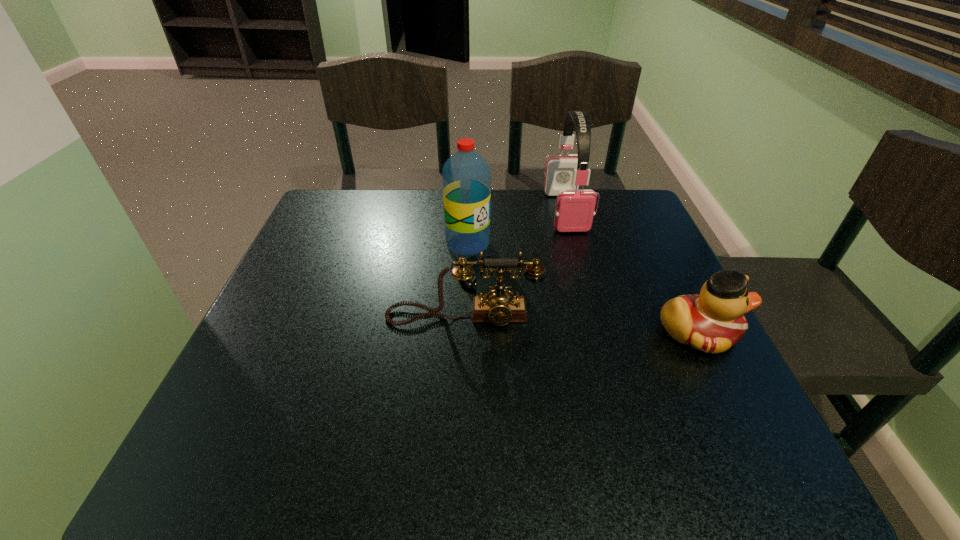
Where is `vacant space located 0.240m on the outer surface of the earphone`? vacant space located 0.240m on the outer surface of the earphone is located at coordinates (594, 301).

The width and height of the screenshot is (960, 540). I want to click on water bottle that is at the far edge, so click(x=466, y=177).

Find the location of `earphone located at the far edge`. earphone located at the far edge is located at coordinates (574, 211).

Where is `duck that is at the right edge`? This screenshot has height=540, width=960. duck that is at the right edge is located at coordinates (712, 322).

Identify the location of earphone that is at the right edge. (574, 211).

I want to click on object located in the far right corner section of the desktop, so click(574, 211).

The image size is (960, 540). In order to click on vacant space at the far edge of the desktop in this screenshot , I will do `click(422, 206)`.

Identify the location of free region at the near edge. (403, 414).

What are the coordinates of `free space at the left edge of the desktop` in the screenshot? It's located at (309, 276).

Image resolution: width=960 pixels, height=540 pixels. I want to click on vacant space at the right edge, so click(x=627, y=282).